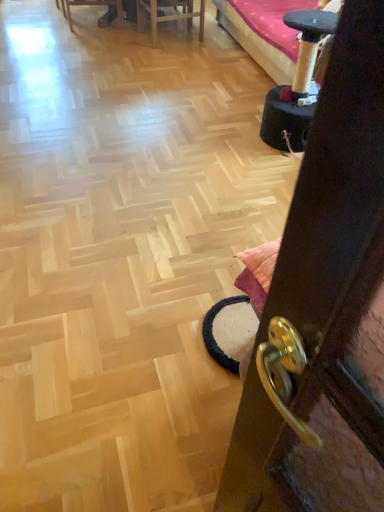
Identify the location of free space underneath wooden chair at upper center (from a real-world perspective). The image size is (384, 512). (172, 35).